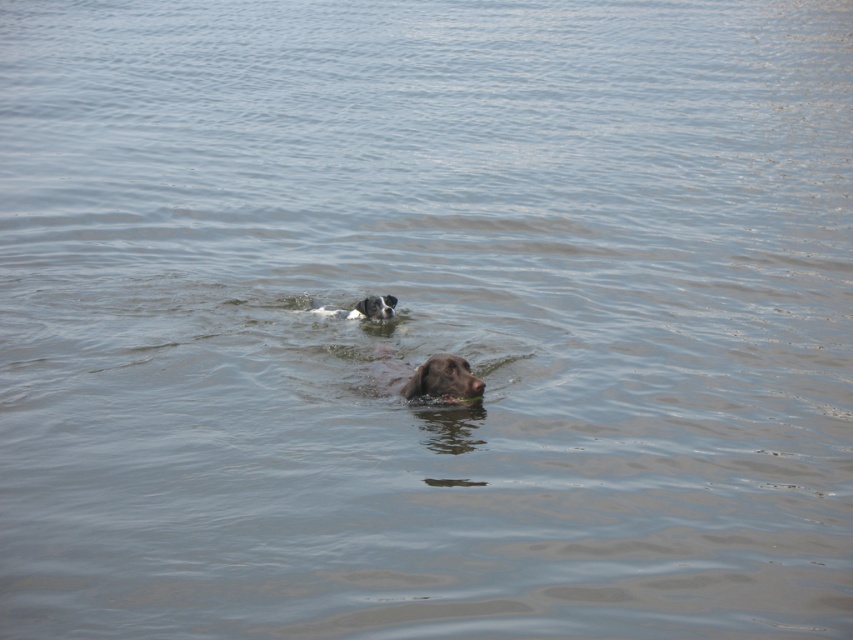
Question: Which point is closer to the camera?

Choices:
 (A) (390, 387)
 (B) (372, 305)

Answer: (A)

Question: Can you confirm if brown matte dog at center is smaller than white-furred dog at center?

Choices:
 (A) yes
 (B) no

Answer: (B)

Question: Is brown matte dog at center to the right of white-furred dog at center from the viewer's perspective?

Choices:
 (A) yes
 (B) no

Answer: (A)

Question: Among these objects, which one is farthest from the camera?

Choices:
 (A) white-furred dog at center
 (B) brown matte dog at center

Answer: (A)

Question: Can you confirm if brown matte dog at center is positioned above white-furred dog at center?

Choices:
 (A) yes
 (B) no

Answer: (B)